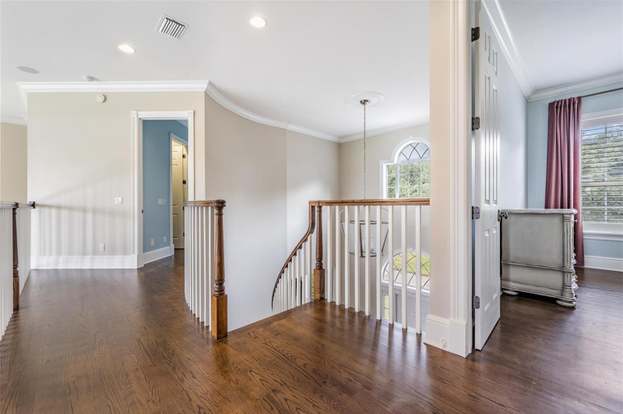
Where is `sky blue wall`? Image resolution: width=623 pixels, height=414 pixels. sky blue wall is located at coordinates (156, 180).